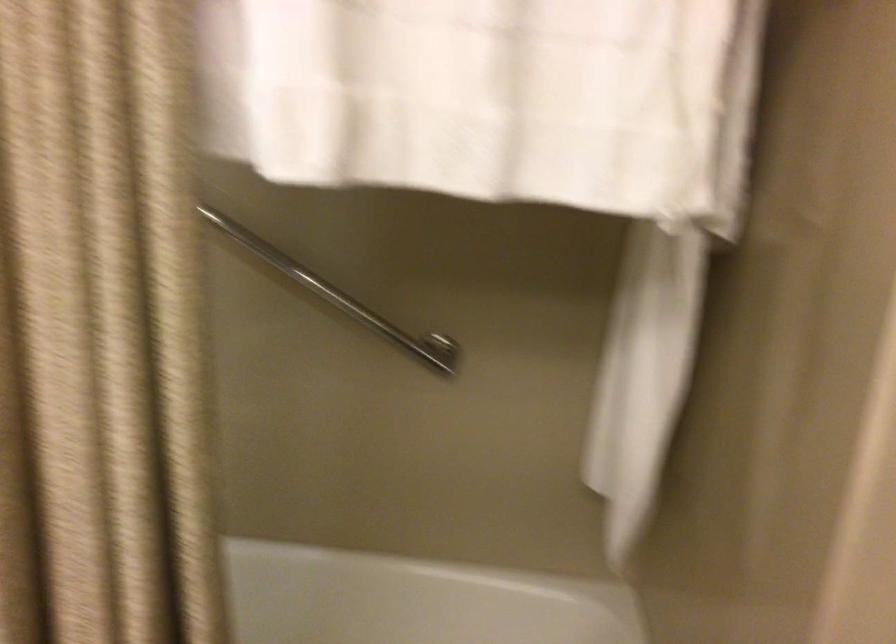
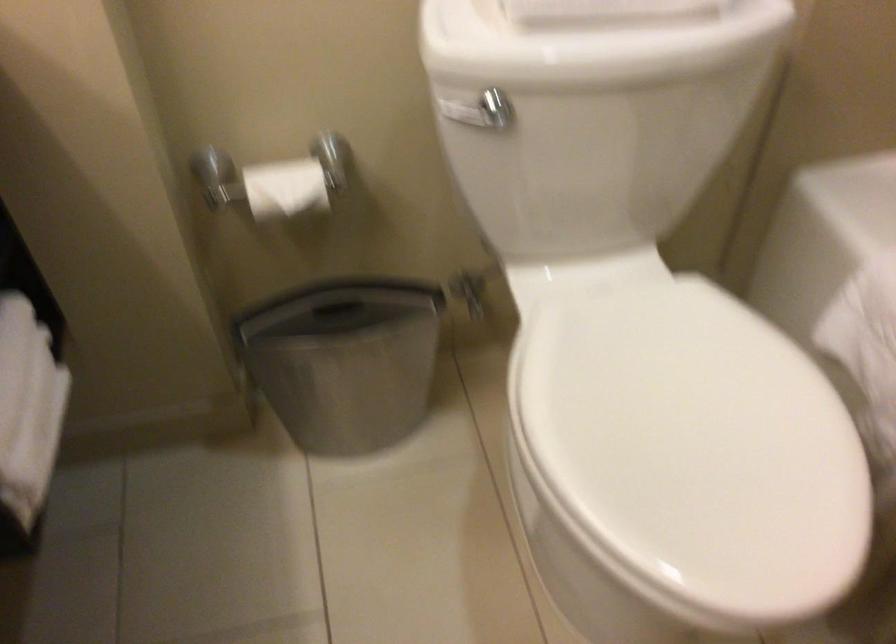
Based on the continuous images, in which direction is the camera rotating?

The rotation direction of the camera is left-down.